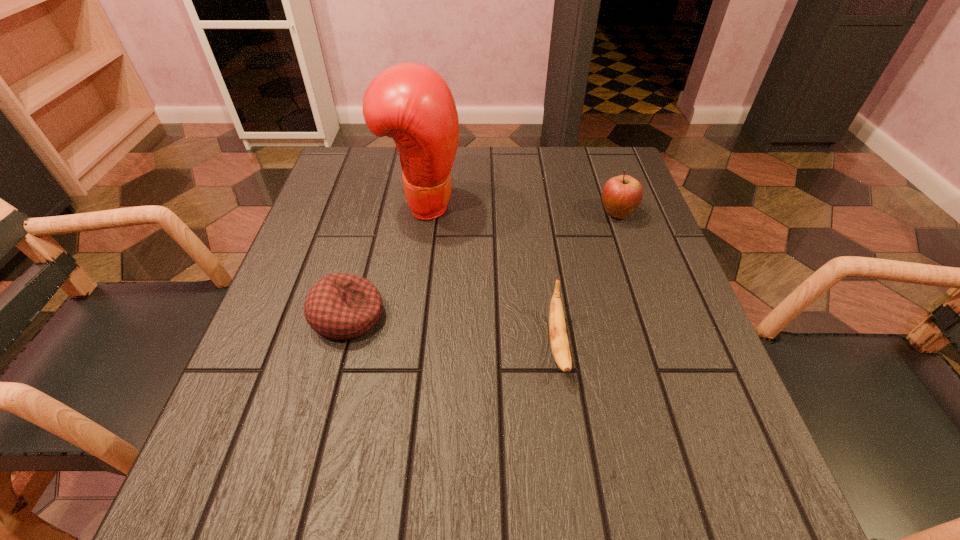
You are a GUI agent. You are given a task and a screenshot of the screen. Output one action in this format:
    pyautogui.click(x=<x>, y=<y>)
    Task: Click on the boxing glove situated at the left edge
    This screenshot has height=540, width=960.
    Given the screenshot: What is the action you would take?
    coord(410,102)

This screenshot has height=540, width=960. I want to click on beanbag present at the left edge, so click(341, 306).

Locate an element on the screen. The height and width of the screenshot is (540, 960). object that is at the right edge is located at coordinates (621, 195).

You are a GUI agent. You are given a task and a screenshot of the screen. Output one action in this format:
    pyautogui.click(x=<x>, y=<y>)
    Task: Click on the object present at the far left corner
    
    Given the screenshot: What is the action you would take?
    pyautogui.click(x=410, y=102)

At what (x,y) coordinates should I click in order to perform the action: click on vacant region at the far edge of the desktop. Please return your answer as a coordinate pair (x, y). Looking at the image, I should click on (522, 190).

The height and width of the screenshot is (540, 960). In order to click on vacant space at the near edge in this screenshot , I will do `click(551, 495)`.

Image resolution: width=960 pixels, height=540 pixels. In the image, there is a desktop. What are the coordinates of `vacant region at the left edge` in the screenshot? It's located at (347, 247).

This screenshot has height=540, width=960. I want to click on free space at the right edge of the desktop, so click(696, 396).

Where is `free space at the far left corner`? free space at the far left corner is located at coordinates (354, 195).

The image size is (960, 540). I want to click on free spot between the rightmost object and the banana, so click(x=588, y=279).